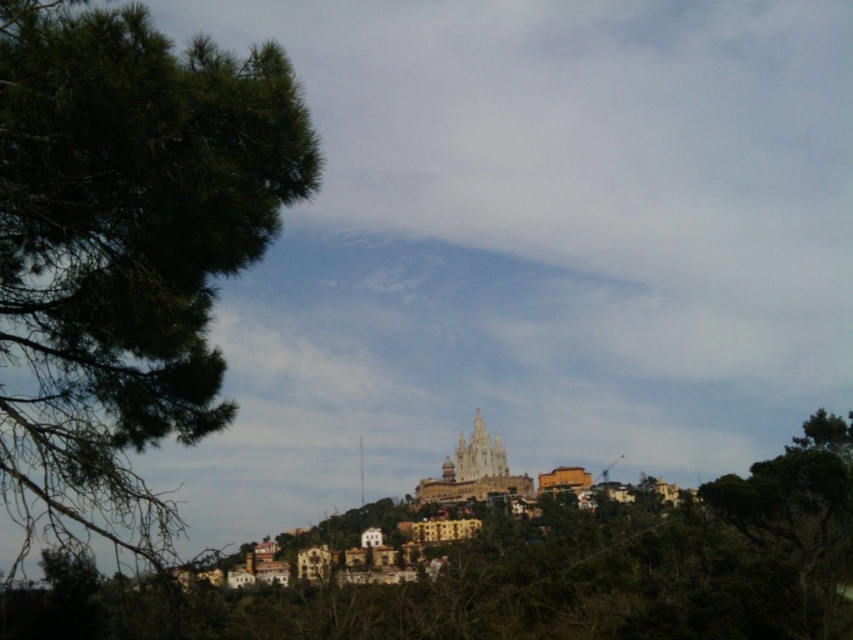
You are standing at the base of the hill and want to walk towards the golden stone tower at center and light brown stone tower at center. Which tower should you approach first if you want to reach the closer one?

The golden stone tower at center is closer to you than the light brown stone tower at center, so you should approach the golden stone tower at center first.

You are standing at the point marked by coordinates point (125, 244) in the image. What do you see immediately in front of you?

You see a green leafy tree immediately in front of you at point (125, 244).

You are standing at the hilltop overlooking the town and notice two points marked on the image. Which of the two points, point (136, 488) or point (462, 458), is closer to your current position?

Point (136, 488) is closer to the camera than point (462, 458), so it is closer to your current position.